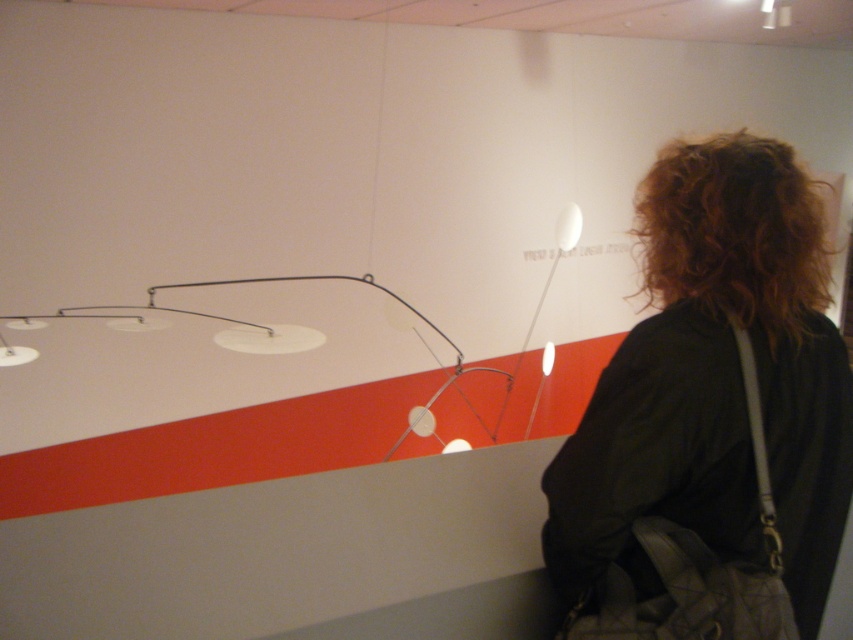
The width and height of the screenshot is (853, 640). Find the location of `dark brown hair at upper right`. dark brown hair at upper right is located at coordinates (715, 381).

Who is positioned more to the right, dark brown hair at upper right or curly brown hair at upper right?

curly brown hair at upper right

Locate an element on the screen. This screenshot has height=640, width=853. dark brown hair at upper right is located at coordinates (715, 381).